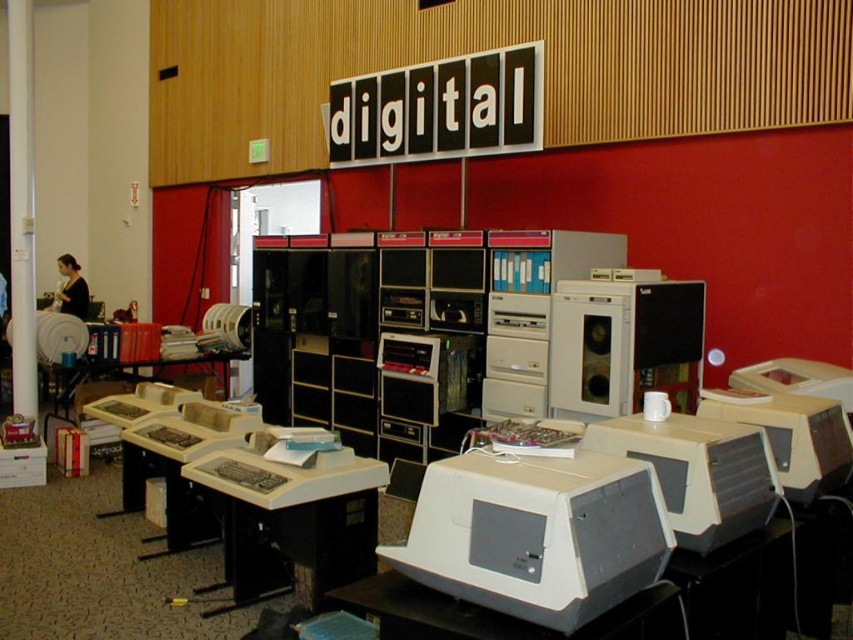
Is point (350, 502) less distant than point (735, 476)?

No, (350, 502) is further to viewer.

Who is higher up, beige plastic table at center or matte gray desktop computer at center?

matte gray desktop computer at center

Is point (224, 509) behind point (773, 499)?

Yes, it is behind point (773, 499).

Locate an element on the screen. beige plastic table at center is located at coordinates (293, 516).

Is gray plastic monitor at center taller than matte black desktop computer at center?

No.

Does gray plastic monitor at center appear on the right side of matte black desktop computer at center?

No, gray plastic monitor at center is not to the right of matte black desktop computer at center.

This screenshot has height=640, width=853. I want to click on gray plastic monitor at center, so click(x=537, y=532).

Does matte black desktop computer at center lie behind matte gray desktop computer at center?

Yes, it is behind matte gray desktop computer at center.

Which is above, matte black desktop computer at center or matte gray desktop computer at center?

matte black desktop computer at center is above.

Who is more distant from viewer, (596, 285) or (705, 452)?

The point (596, 285) is behind.

Locate an element on the screen. The image size is (853, 640). matte black desktop computer at center is located at coordinates (624, 344).